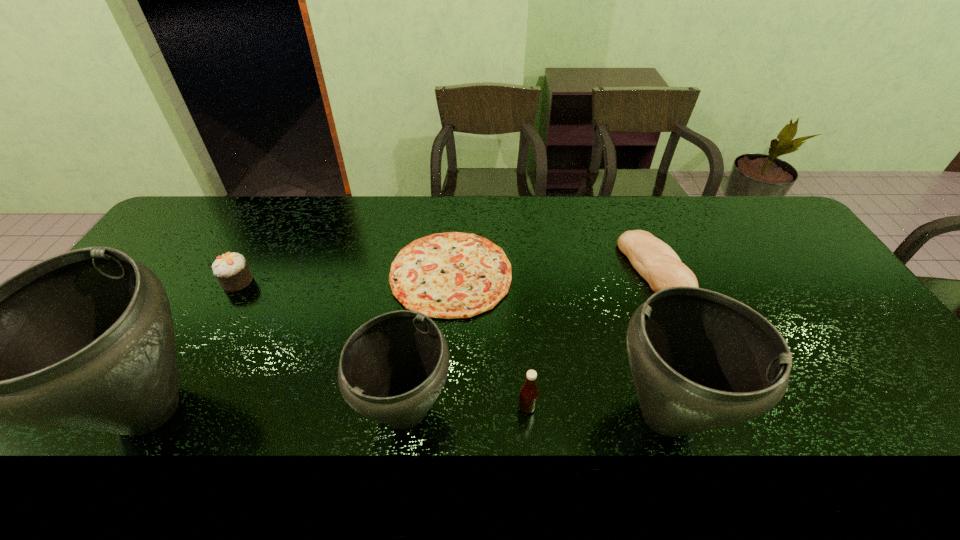
Image resolution: width=960 pixels, height=540 pixels. I want to click on free space for a new urn on the right, so click(929, 417).